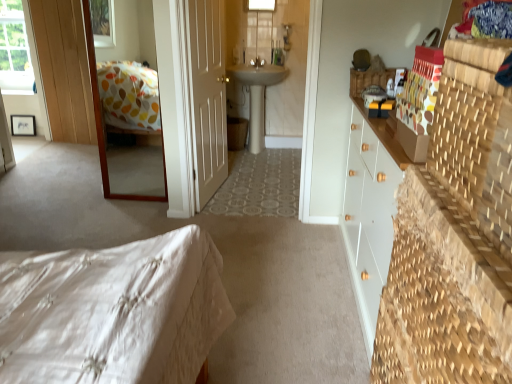
At what (x,y) coordinates should I click in order to perform the action: click on vacant space behind white matte door at center. Please return your answer as a coordinate pair (x, y). Image resolution: width=512 pixels, height=384 pixels. Looking at the image, I should click on (243, 179).